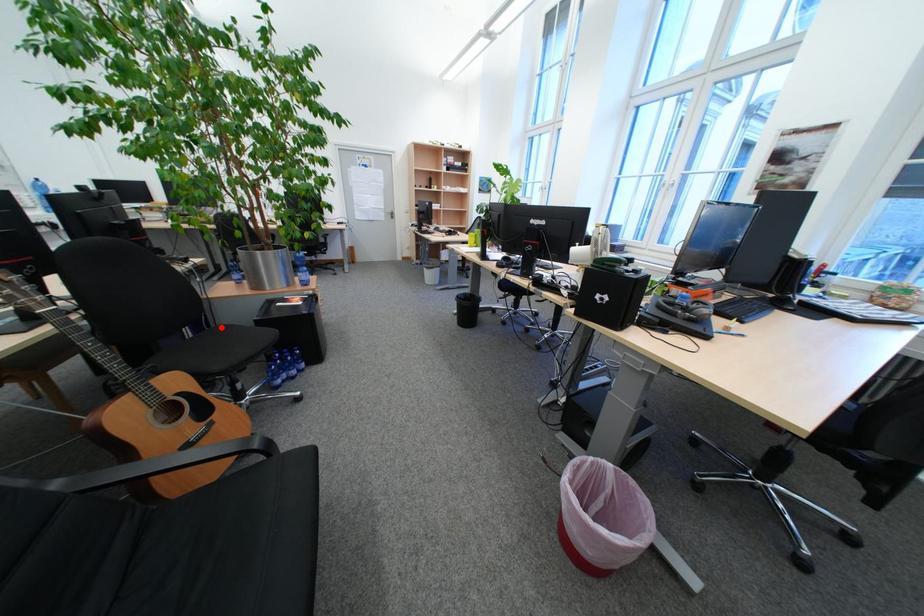
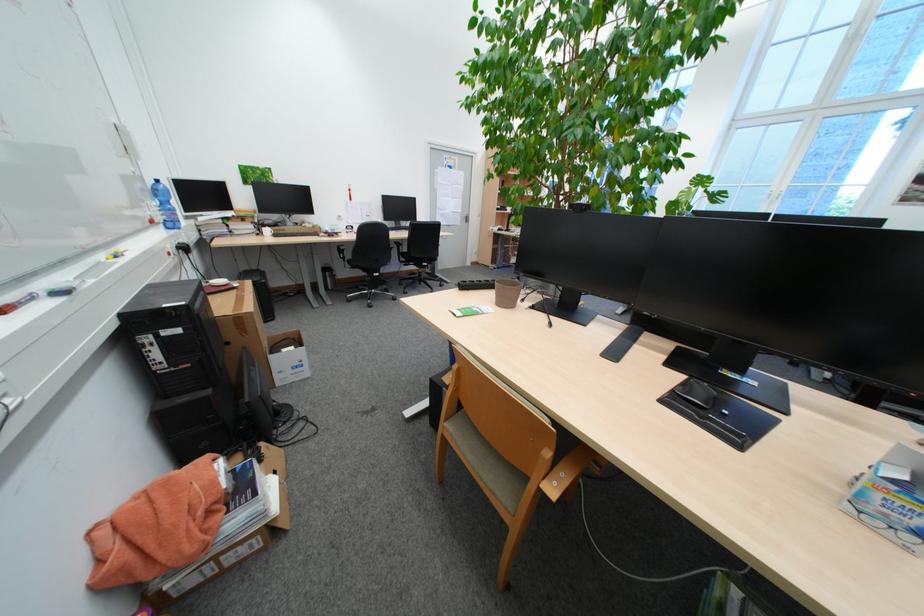
Question: I am providing you with two images of the same scene from different viewpoints. A red point is marked on the first image. Can you still see the location of the red point in image 2?

Choices:
 (A) Yes
 (B) No

Answer: (B)